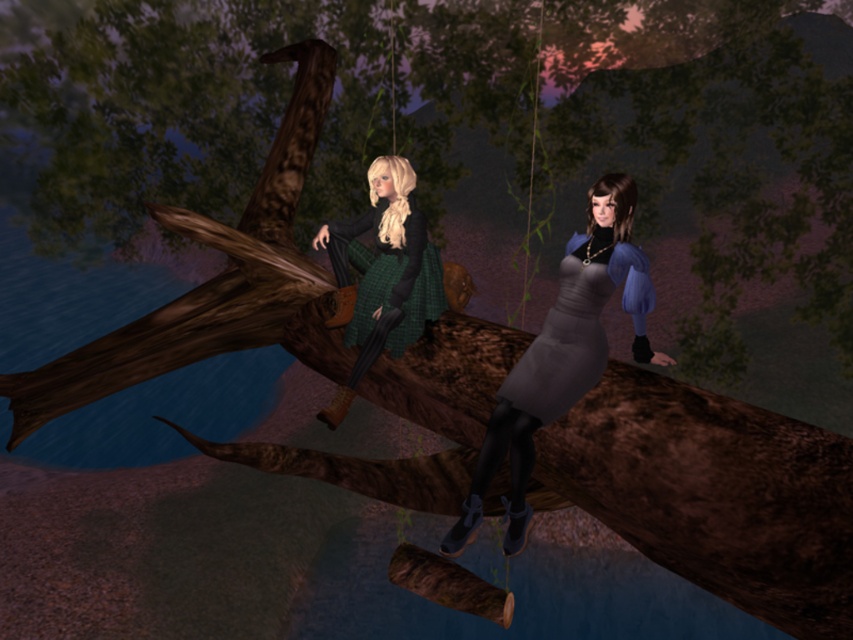
You are an artist sketching the scene and need to place the matte gray dress at center accurately. According to the coordinates provided, where should you position it on your drawing canvas?

The matte gray dress at center should be positioned at coordinates point (561, 355).